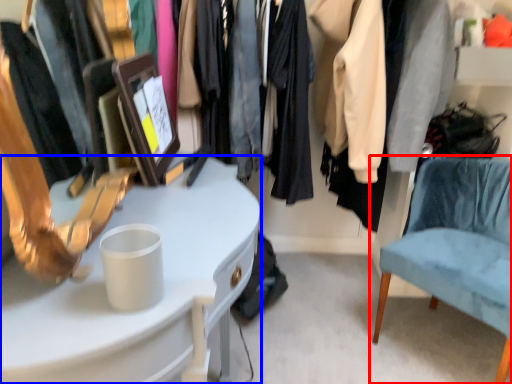
Question: Which of the following is the farthest to the observer, chair (highlighted by a red box) or desk (highlighted by a blue box)?

Choices:
 (A) chair
 (B) desk

Answer: (A)